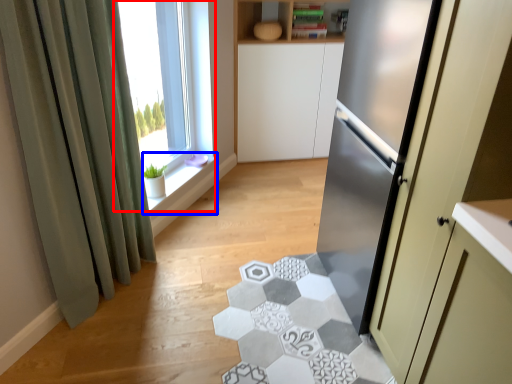
Question: Which point is further to the camera, window (highlighted by a red box) or window sill (highlighted by a blue box)?

Choices:
 (A) window
 (B) window sill

Answer: (B)